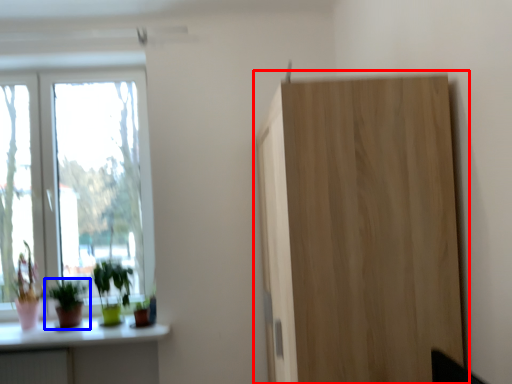
Question: Which point is further to the camera, cupboard (highlighted by a red box) or houseplant (highlighted by a blue box)?

Choices:
 (A) cupboard
 (B) houseplant

Answer: (B)